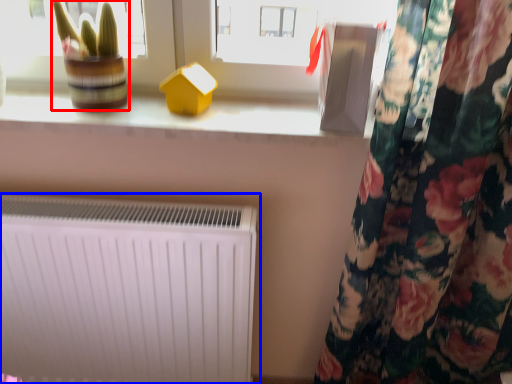
Question: Which point is closer to the camera, plant (highlighted by a red box) or radiator (highlighted by a blue box)?

Choices:
 (A) plant
 (B) radiator

Answer: (A)